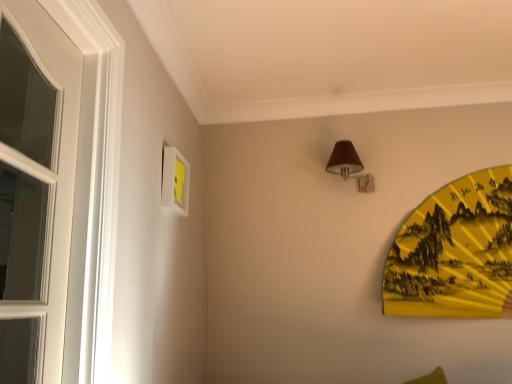
Question: From a real-world perspective, is yellow paper fan at right physically below brown fabric lampshade at upper center?

Choices:
 (A) yes
 (B) no

Answer: (A)

Question: Is yellow paper fan at right touching brown fabric lampshade at upper center?

Choices:
 (A) no
 (B) yes

Answer: (A)

Question: Does yellow paper fan at right have a lesser width compared to brown fabric lampshade at upper center?

Choices:
 (A) yes
 (B) no

Answer: (A)

Question: Considering the relative sizes of yellow paper fan at right and brown fabric lampshade at upper center in the image provided, is yellow paper fan at right wider than brown fabric lampshade at upper center?

Choices:
 (A) no
 (B) yes

Answer: (A)

Question: Does yellow paper fan at right have a larger size compared to brown fabric lampshade at upper center?

Choices:
 (A) no
 (B) yes

Answer: (B)

Question: In the image, is yellow paper fan at right positioned in front of or behind white matte picture frame at upper left?

Choices:
 (A) behind
 (B) front

Answer: (A)

Question: Considering the positions of yellow paper fan at right and white matte picture frame at upper left in the image, is yellow paper fan at right taller or shorter than white matte picture frame at upper left?

Choices:
 (A) short
 (B) tall

Answer: (B)

Question: Is point (485, 299) closer or farther from the camera than point (177, 200)?

Choices:
 (A) farther
 (B) closer

Answer: (A)

Question: Is yellow paper fan at right spatially inside white matte picture frame at upper left, or outside of it?

Choices:
 (A) outside
 (B) inside

Answer: (A)

Question: Would you say white matte picture frame at upper left is inside or outside brown fabric lampshade at upper center?

Choices:
 (A) inside
 (B) outside

Answer: (B)

Question: From their relative heights in the image, would you say white matte picture frame at upper left is taller or shorter than brown fabric lampshade at upper center?

Choices:
 (A) tall
 (B) short

Answer: (A)

Question: From the image's perspective, relative to brown fabric lampshade at upper center, is white matte picture frame at upper left above or below?

Choices:
 (A) above
 (B) below

Answer: (B)

Question: From a real-world perspective, relative to brown fabric lampshade at upper center, is white matte picture frame at upper left vertically above or below?

Choices:
 (A) above
 (B) below

Answer: (B)

Question: From a real-world perspective, is brown fabric lampshade at upper center positioned above or below yellow paper fan at right?

Choices:
 (A) below
 (B) above

Answer: (B)

Question: In the image, is brown fabric lampshade at upper center positioned in front of or behind yellow paper fan at right?

Choices:
 (A) front
 (B) behind

Answer: (B)